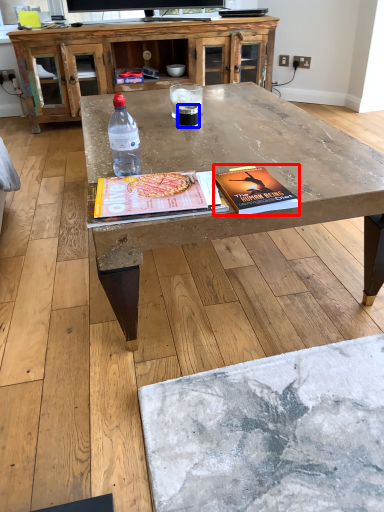
Question: Among these objects, which one is nearest to the camera, paperback book (highlighted by a red box) or beverage (highlighted by a blue box)?

Choices:
 (A) paperback book
 (B) beverage

Answer: (A)